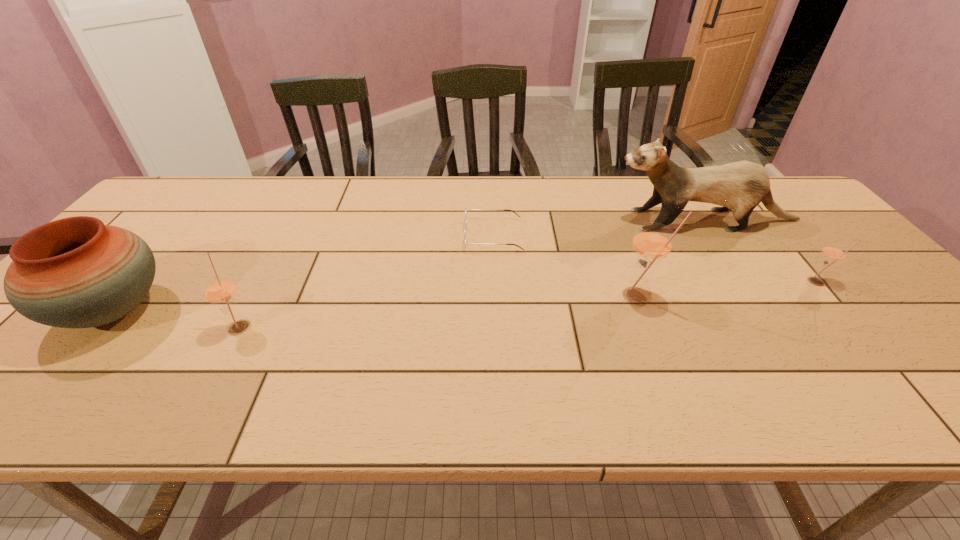
If we want them evenly spaced by inserting an extra straw_(for_drinking) among them, please locate a free spot for this new straw_(for_drinking). Please provide its 2D coordinates. Your answer should be formatted as a tuple, i.e. [(x, y)], where the tuple contains the x and y coordinates of a point satisfying the conditions above.

[(445, 310)]